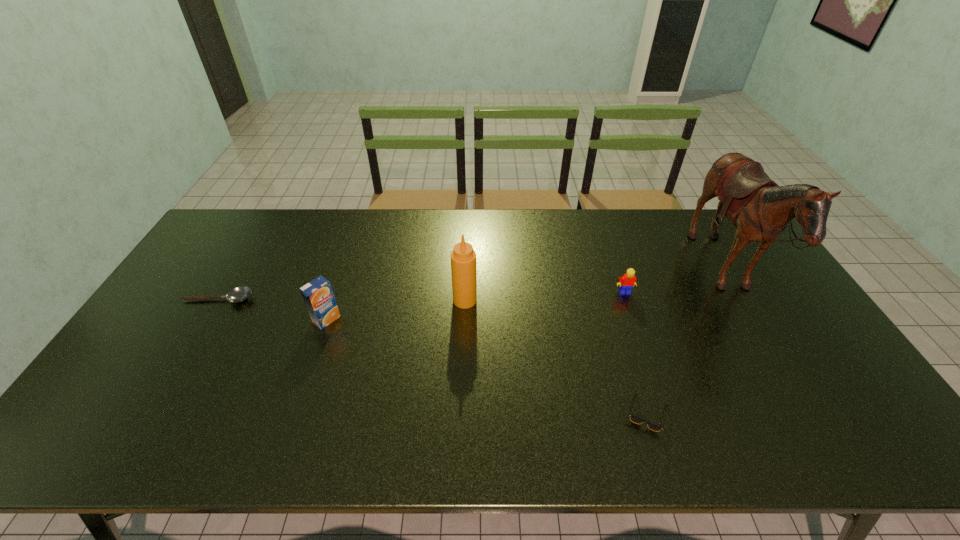
Locate an element on the screen. This screenshot has height=540, width=960. free point between the Lego and the tallest object is located at coordinates (675, 284).

Where is `unoccupied area between the condiment and the saddle`? This screenshot has width=960, height=540. unoccupied area between the condiment and the saddle is located at coordinates (595, 287).

Identify the location of vacant area that lies between the third shortest object and the fourth object from right to left. The width and height of the screenshot is (960, 540). (544, 296).

At what (x,y) coordinates should I click in order to perform the action: click on free area in between the saddle and the Lego. Please return your answer as a coordinate pair (x, y). Image resolution: width=960 pixels, height=540 pixels. Looking at the image, I should click on (675, 284).

Find the location of `free space between the second tallest object and the shortest object`. free space between the second tallest object and the shortest object is located at coordinates (342, 299).

What are the coordinates of `empty space that is in between the fourth shortest object and the tallest object` in the screenshot? It's located at (526, 296).

Where is `object that can be found as the fifth closest to the nearest object`? This screenshot has width=960, height=540. object that can be found as the fifth closest to the nearest object is located at coordinates (238, 294).

Find the location of a particular element. The width and height of the screenshot is (960, 540). the fourth closest object to the condiment is located at coordinates (238, 294).

This screenshot has height=540, width=960. Identify the location of free point that satisfies the following two spatial constraints: 1. on the back of the tallest object; 2. on the front-facing side of the Lego. (736, 293).

I want to click on vacant point that satisfies the following two spatial constraints: 1. on the back of the rightmost object; 2. on the lenses of the sunglasses, so click(808, 413).